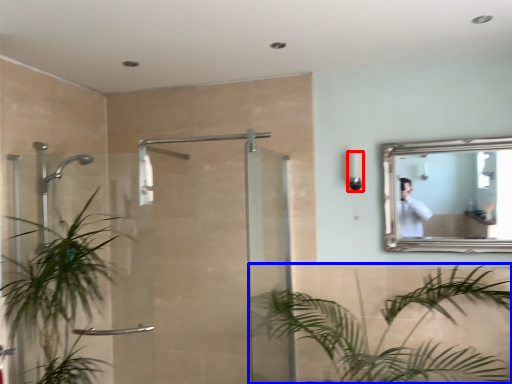
Question: Among these objects, which one is farthest to the camera, light fixture (highlighted by a red box) or houseplant (highlighted by a blue box)?

Choices:
 (A) light fixture
 (B) houseplant

Answer: (A)